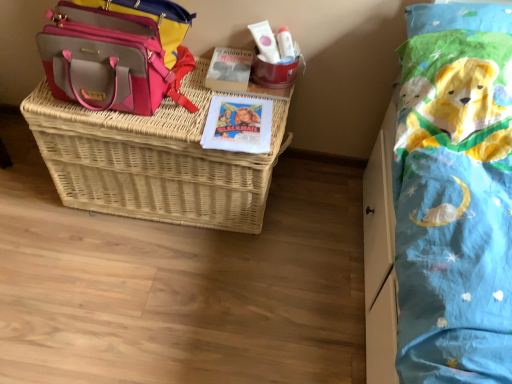
I want to click on free space in front of woven wicker basket at center, so click(156, 294).